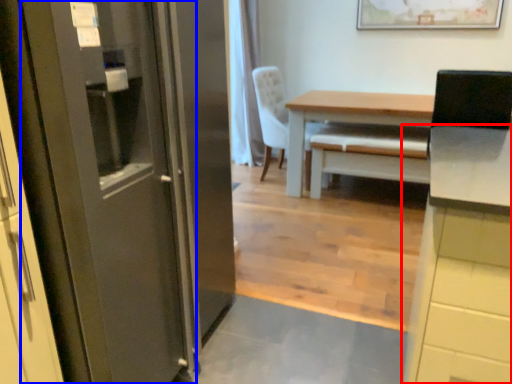
Question: Among these objects, which one is farthest to the camera, cabinetry (highlighted by a red box) or door (highlighted by a blue box)?

Choices:
 (A) cabinetry
 (B) door

Answer: (A)